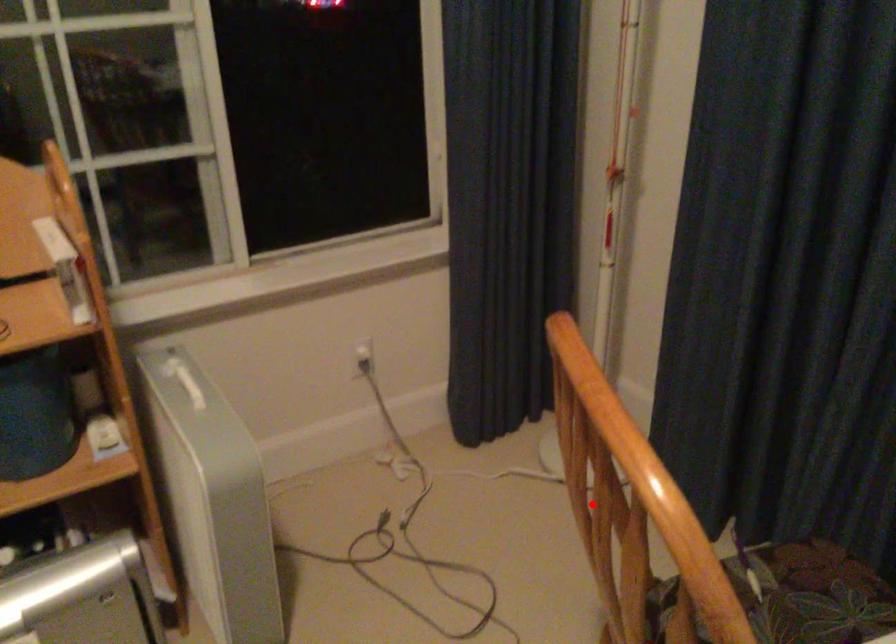
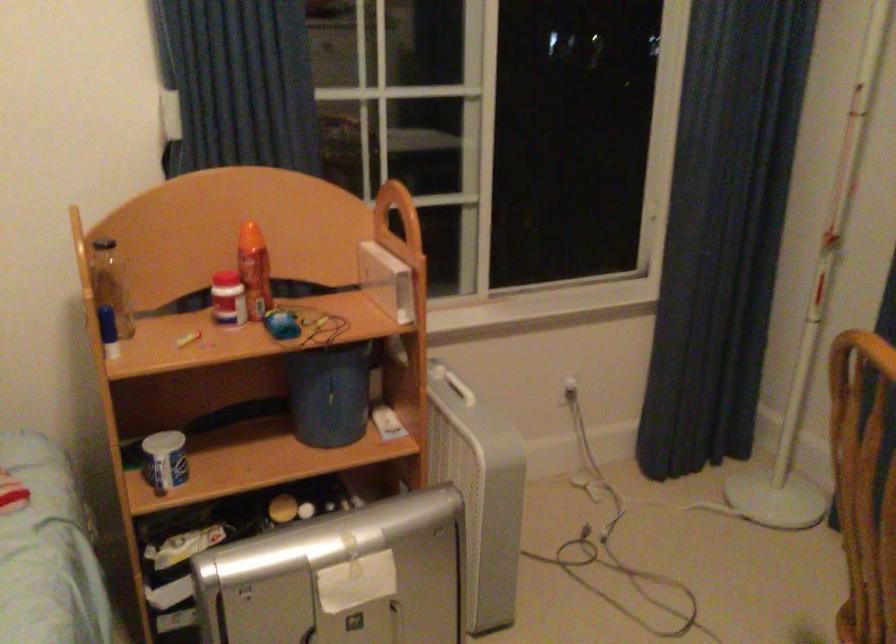
Question: I am providing you with two images of the same scene from different viewpoints. A red point is shown in image1. For the corresponding object point in image2, is it positioned nearer or farther from the camera?

Choices:
 (A) Nearer
 (B) Farther

Answer: (B)